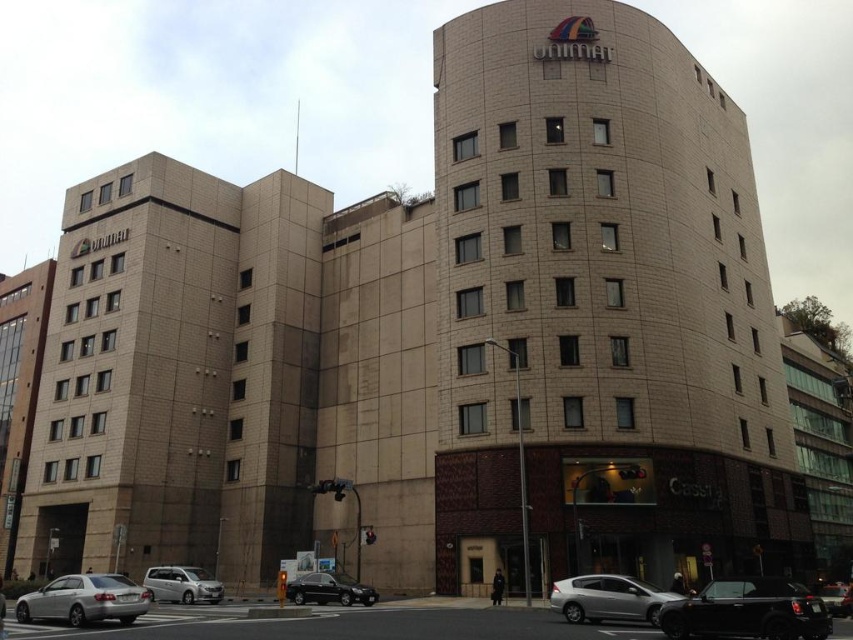
Question: Which point is farther from the camera taking this photo?

Choices:
 (A) (167, 564)
 (B) (759, 618)

Answer: (A)

Question: Does beige brick building at center have a smaller size compared to silver metallic van at center?

Choices:
 (A) yes
 (B) no

Answer: (B)

Question: Which object appears closest to the camera in this image?

Choices:
 (A) beige brick building at center
 (B) silver metallic van at center
 (C) silver metallic sedan at lower left

Answer: (C)

Question: Which of the following is the farthest from the observer?

Choices:
 (A) shiny black sedan at lower center
 (B) silver metallic van at center

Answer: (B)

Question: From the image, what is the correct spatial relationship of shiny black car at lower right in relation to silver metallic sedan at lower left?

Choices:
 (A) below
 (B) above

Answer: (B)

Question: Does beige brick building at center appear over shiny black car at lower right?

Choices:
 (A) yes
 (B) no

Answer: (A)